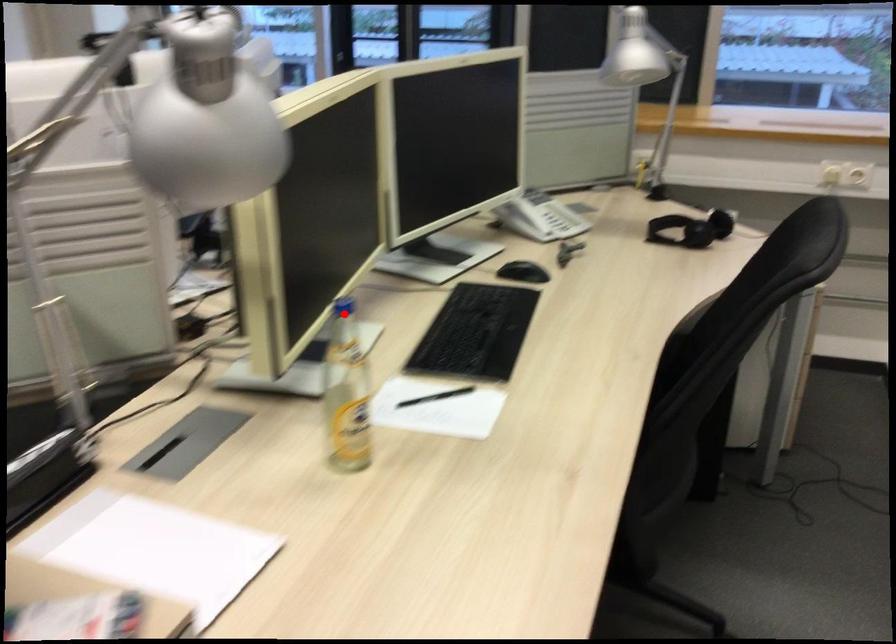
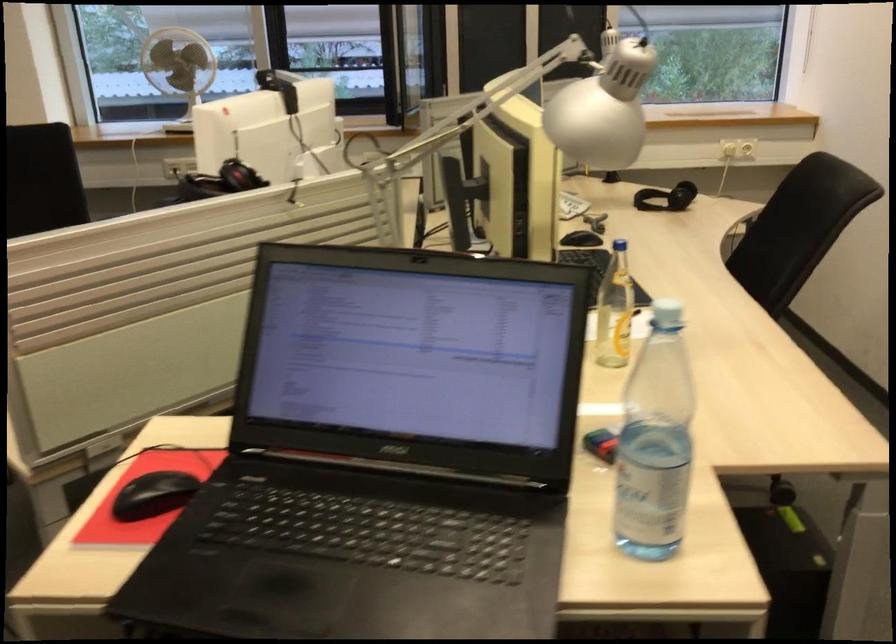
Question: A red point is marked in image1. In image2, is the corresponding 3D point closer to the camera or farther? Reply with the corresponding letter.

Choices:
 (A) The corresponding 3D point is closer.
 (B) The corresponding 3D point is farther.

Answer: (B)